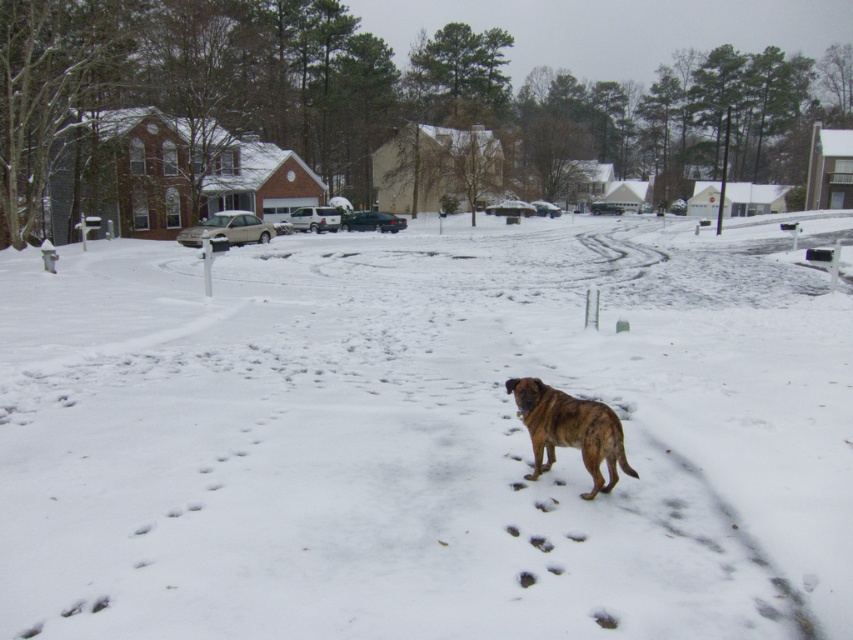
Question: Which point appears closest to the camera in this image?

Choices:
 (A) (579, 436)
 (B) (173, 246)

Answer: (A)

Question: Is white fluffy snow at center behind brindle fur dog at center?

Choices:
 (A) no
 (B) yes

Answer: (A)

Question: Which object is closer to the camera taking this photo?

Choices:
 (A) brindle fur dog at center
 (B) white fluffy snow at center

Answer: (B)

Question: Does white fluffy snow at center appear over brindle fur dog at center?

Choices:
 (A) yes
 (B) no

Answer: (A)

Question: Can you confirm if white fluffy snow at center is positioned to the right of brindle fur dog at center?

Choices:
 (A) no
 (B) yes

Answer: (A)